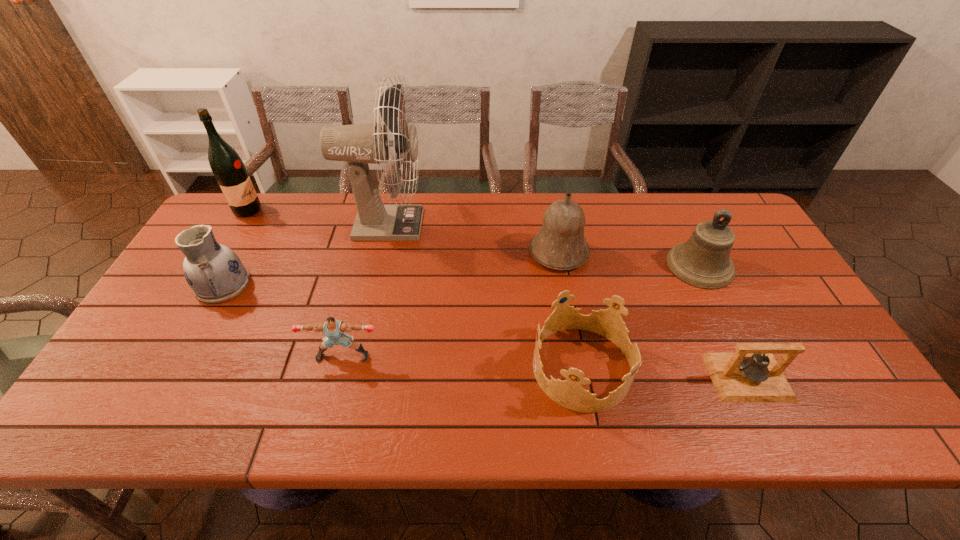
Where is `fan`? This screenshot has height=540, width=960. fan is located at coordinates (359, 144).

Identify the location of the seventh shortest object. (229, 170).

Image resolution: width=960 pixels, height=540 pixels. I want to click on the leftmost bell, so click(x=560, y=244).

Identify the location of pottery. (215, 273).

This screenshot has width=960, height=540. What are the coordinates of `tiara` in the screenshot? It's located at (569, 393).

Where is `puncher`? puncher is located at coordinates (333, 329).

Find the location of a particular element. The image size is (960, 540). the nearest bell is located at coordinates (751, 374).

I want to click on the shortest object, so click(751, 374).

In order to click on vacant space located 0.220m on the air flow direction of the fan in this screenshot , I will do `click(493, 225)`.

I want to click on blank area located on the front-facing side of the liquor, so click(x=312, y=210).